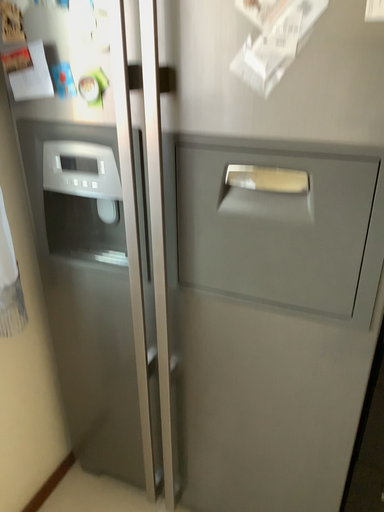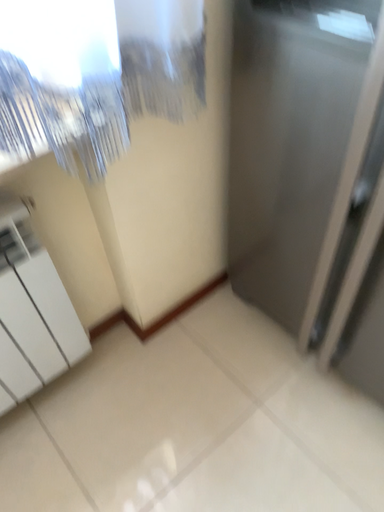
Question: How did the camera likely rotate when shooting the video?

Choices:
 (A) rotated left
 (B) rotated right

Answer: (A)